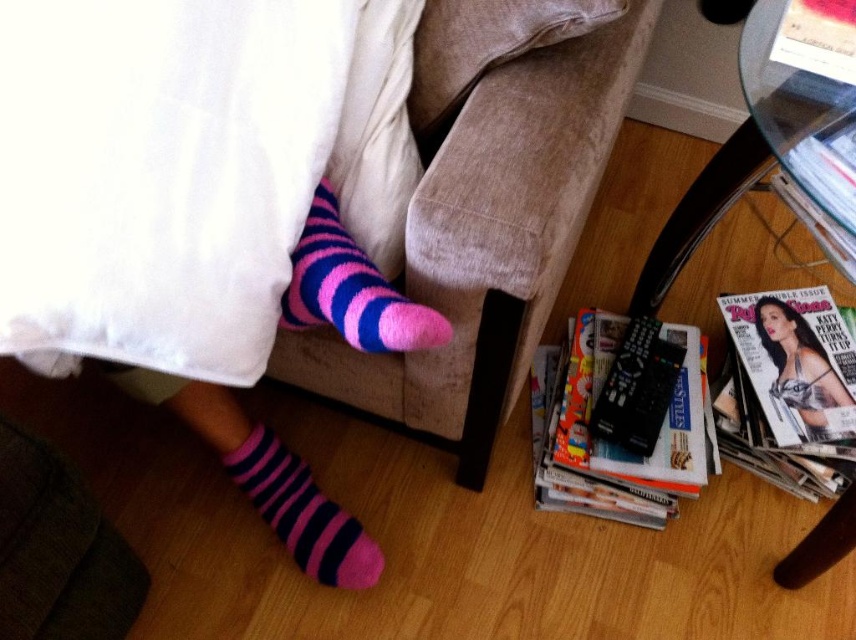
Is point (325, 509) closer to viewer compared to point (795, 314)?

That is True.

Does pink striped sock at lower left appear over matte black magazine at lower right?

Incorrect, pink striped sock at lower left is not positioned above matte black magazine at lower right.

The height and width of the screenshot is (640, 856). What do you see at coordinates (302, 513) in the screenshot?
I see `pink striped sock at lower left` at bounding box center [302, 513].

Locate an element on the screen. pink striped sock at lower left is located at coordinates (302, 513).

Does printed glossy magazine at lower right have a lesser height compared to matte black magazine at lower right?

No.

Who is more forward, (658, 484) or (759, 298)?

Point (658, 484)

I want to click on printed glossy magazine at lower right, so click(x=580, y=467).

Who is positioned more to the right, suede-like beige couch at center or matte glossy magazine at lower right?

matte glossy magazine at lower right is more to the right.

The image size is (856, 640). What do you see at coordinates (294, 188) in the screenshot?
I see `suede-like beige couch at center` at bounding box center [294, 188].

Identify the location of suede-like beige couch at center. The width and height of the screenshot is (856, 640). (294, 188).